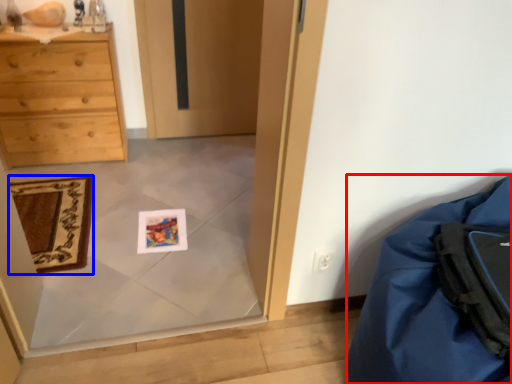
Question: Which object appears closest to the camera in this image, furniture (highlighted by a red box) or mat (highlighted by a blue box)?

Choices:
 (A) furniture
 (B) mat

Answer: (A)